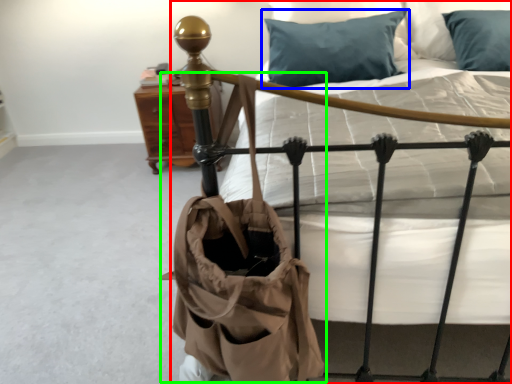
Question: Estimate the real-world distances between objects in this image. Which object is closer to bed (highlighted by a red box), pillow (highlighted by a blue box) or shoulder bag (highlighted by a green box)?

Choices:
 (A) pillow
 (B) shoulder bag

Answer: (B)